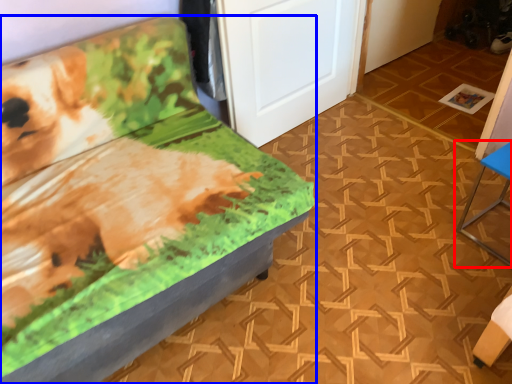
Question: Which object is closer to the camera taking this photo, furniture (highlighted by a red box) or furniture (highlighted by a blue box)?

Choices:
 (A) furniture
 (B) furniture

Answer: (B)